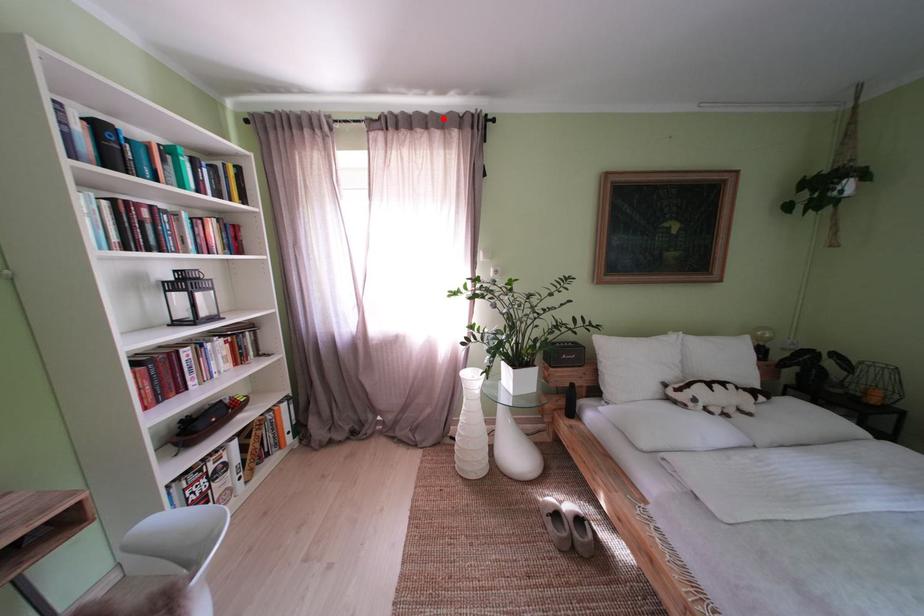
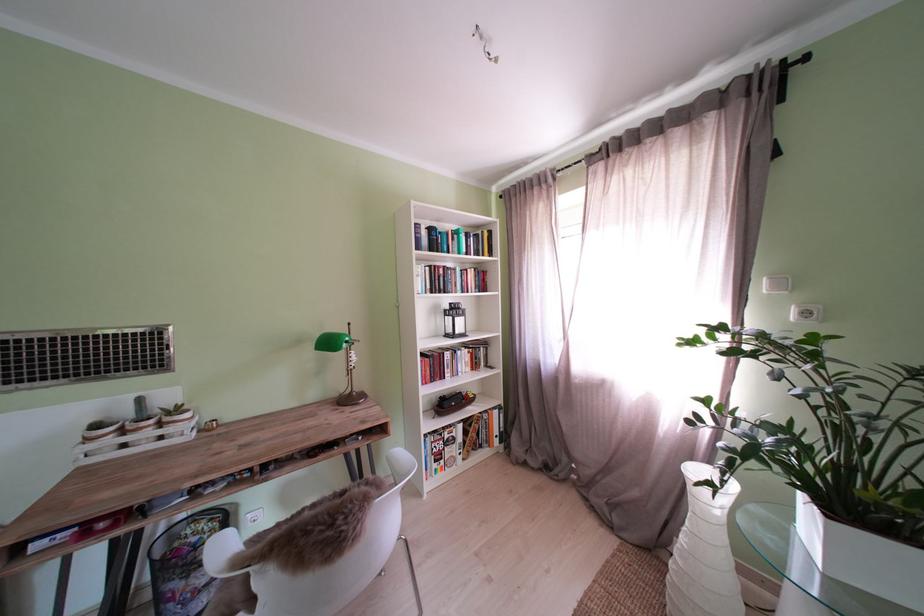
Where in the second image is the point corresponding to the highlighted location from the first image?

(681, 116)